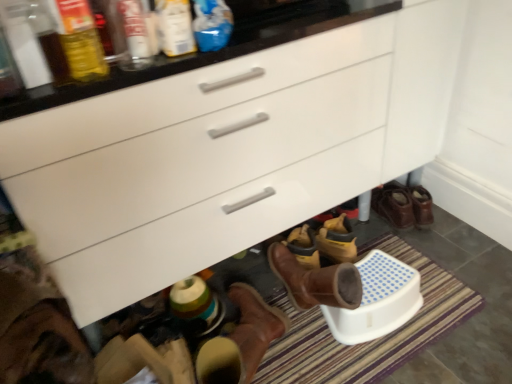
What do you see at coordinates (369, 341) in the screenshot?
I see `striped carpet at lower center` at bounding box center [369, 341].

The height and width of the screenshot is (384, 512). What are the coordinates of `brown leather boots at lower right` in the screenshot? It's located at (403, 205).

Where is `striped carpet at lower center`? The height and width of the screenshot is (384, 512). striped carpet at lower center is located at coordinates (369, 341).

From a real-world perspective, is translucent plastic bottle at upper left, which appears as the second bottle when viewed from the left, over blue plastic bottle at upper center, which appears as the first bottle when viewed from the right?

Yes, from a real-world perspective, translucent plastic bottle at upper left, which appears as the second bottle when viewed from the left, is over blue plastic bottle at upper center, which appears as the first bottle when viewed from the right

Does point (63, 44) appear closer or farther from the camera than point (198, 23)?

Point (63, 44) is positioned closer to the camera compared to point (198, 23).

Does translucent plastic bottle at upper left, the third bottle from the right, have a greater height compared to blue plastic bottle at upper center, which appears as the first bottle when viewed from the right?

Indeed, translucent plastic bottle at upper left, the third bottle from the right, has a greater height compared to blue plastic bottle at upper center, which appears as the first bottle when viewed from the right.

Considering the sizes of objects translucent plastic bottle at upper left, which appears as the second bottle when viewed from the left, and blue plastic bottle at upper center, which appears as the first bottle when viewed from the right, in the image provided, who is wider, translucent plastic bottle at upper left, which appears as the second bottle when viewed from the left, or blue plastic bottle at upper center, which appears as the first bottle when viewed from the right,?

Wider between the two is translucent plastic bottle at upper left, which appears as the second bottle when viewed from the left.

Considering the sizes of objects matte glass bottle at upper left, which ranks as the fourth bottle in right-to-left order, and blue plastic bottle at upper center, which appears as the first bottle when viewed from the right, in the image provided, who is smaller, matte glass bottle at upper left, which ranks as the fourth bottle in right-to-left order, or blue plastic bottle at upper center, which appears as the first bottle when viewed from the right,?

With smaller size is blue plastic bottle at upper center, which appears as the first bottle when viewed from the right.

Would you say matte glass bottle at upper left, which ranks as the fourth bottle in right-to-left order, is a long distance from blue plastic bottle at upper center, which appears as the first bottle when viewed from the right?

No, matte glass bottle at upper left, which ranks as the fourth bottle in right-to-left order, is in close proximity to blue plastic bottle at upper center, which appears as the first bottle when viewed from the right.

Is matte glass bottle at upper left, the first bottle viewed from the left, outside of blue plastic bottle at upper center, the fourth bottle in the left-to-right sequence?

Yes, matte glass bottle at upper left, the first bottle viewed from the left, is not within blue plastic bottle at upper center, the fourth bottle in the left-to-right sequence.

From the image's perspective, is matte glass bottle at upper left, which ranks as the fourth bottle in right-to-left order, beneath blue plastic bottle at upper center, the fourth bottle in the left-to-right sequence?

Correct, matte glass bottle at upper left, which ranks as the fourth bottle in right-to-left order, appears lower than blue plastic bottle at upper center, the fourth bottle in the left-to-right sequence, in the image.

Is blue plastic bottle at upper center, which appears as the first bottle when viewed from the right, touching striped carpet at lower center?

blue plastic bottle at upper center, which appears as the first bottle when viewed from the right, and striped carpet at lower center are not in contact.

Considering the relative positions of blue plastic bottle at upper center, which appears as the first bottle when viewed from the right, and striped carpet at lower center in the image provided, is blue plastic bottle at upper center, which appears as the first bottle when viewed from the right, to the left of striped carpet at lower center from the viewer's perspective?

Indeed, blue plastic bottle at upper center, which appears as the first bottle when viewed from the right, is positioned on the left side of striped carpet at lower center.

Could you measure the distance between blue plastic bottle at upper center, the fourth bottle in the left-to-right sequence, and striped carpet at lower center?

1.02 meters.

Can you confirm if blue plastic bottle at upper center, which appears as the first bottle when viewed from the right, is bigger than matte glass bottle at upper left, which ranks as the fourth bottle in right-to-left order?

Actually, blue plastic bottle at upper center, which appears as the first bottle when viewed from the right, might be smaller than matte glass bottle at upper left, which ranks as the fourth bottle in right-to-left order.

Based on the photo, is blue plastic bottle at upper center, the fourth bottle in the left-to-right sequence, looking in the opposite direction of matte glass bottle at upper left, the first bottle viewed from the left?

That's not correct — blue plastic bottle at upper center, the fourth bottle in the left-to-right sequence, is not looking away from matte glass bottle at upper left, the first bottle viewed from the left.

Would you say blue plastic bottle at upper center, which appears as the first bottle when viewed from the right, is outside matte glass bottle at upper left, the first bottle viewed from the left?

Yes, blue plastic bottle at upper center, which appears as the first bottle when viewed from the right, is not within matte glass bottle at upper left, the first bottle viewed from the left.

Is blue plastic bottle at upper center, the fourth bottle in the left-to-right sequence, with matte glass bottle at upper left, the first bottle viewed from the left?

No, blue plastic bottle at upper center, the fourth bottle in the left-to-right sequence, is not next to matte glass bottle at upper left, the first bottle viewed from the left.

Which is more to the left, matte plastic bottle at upper center, the 3th bottle when ordered from left to right, or brown leather boots at lower right?

From the viewer's perspective, matte plastic bottle at upper center, the 3th bottle when ordered from left to right, appears more on the left side.

Looking at their sizes, would you say matte plastic bottle at upper center, positioned as the second bottle in right-to-left order, is wider or thinner than brown leather boots at lower right?

matte plastic bottle at upper center, positioned as the second bottle in right-to-left order, is thinner than brown leather boots at lower right.

The width and height of the screenshot is (512, 384). Identify the location of footwear beneath the matte plastic bottle at upper center, the 3th bottle when ordered from left to right (from a real-world perspective). (403, 205).

Which is further, (85,4) or (432,313)?

Positioned behind is point (432,313).

Considering the sizes of objects translucent plastic bottle at upper left, which appears as the second bottle when viewed from the left, and striped carpet at lower center in the image provided, who is taller, translucent plastic bottle at upper left, which appears as the second bottle when viewed from the left, or striped carpet at lower center?

translucent plastic bottle at upper left, which appears as the second bottle when viewed from the left.

From the image's perspective, which bottle is the 2nd one above the striped carpet at lower center? Please provide its 2D coordinates.

[(80, 40)]

Is translucent plastic bottle at upper left, the third bottle from the right, situated inside striped carpet at lower center or outside?

translucent plastic bottle at upper left, the third bottle from the right, is spatially situated outside striped carpet at lower center.

From a real-world perspective, who is located lower, striped carpet at lower center or translucent plastic bottle at upper left, the third bottle from the right?

striped carpet at lower center.

Is striped carpet at lower center completely or partially outside of translucent plastic bottle at upper left, the third bottle from the right?

striped carpet at lower center lies outside translucent plastic bottle at upper left, the third bottle from the right,'s area.

Is point (404, 341) closer or farther from the camera than point (108, 73)?

Clearly, point (404, 341) is more distant from the camera than point (108, 73).

Relative to translucent plastic bottle at upper left, which appears as the second bottle when viewed from the left, is striped carpet at lower center in front or behind?

Clearly, striped carpet at lower center is behind translucent plastic bottle at upper left, which appears as the second bottle when viewed from the left.

I want to click on bottle that is the 3rd object above the blue plastic bottle at upper center, which appears as the first bottle when viewed from the right (from a real-world perspective), so click(x=80, y=40).

Locate an element on the screen. This screenshot has width=512, height=384. the 3rd bottle to the right of the matte glass bottle at upper left, the first bottle viewed from the left, counting from the anchor's position is located at coordinates (212, 24).

Which object lies further to the anchor point striped carpet at lower center, translucent plastic bottle at upper left, the third bottle from the right, or blue plastic bottle at upper center, which appears as the first bottle when viewed from the right?

translucent plastic bottle at upper left, the third bottle from the right, is positioned further to the anchor striped carpet at lower center.

Estimate the real-world distances between objects in this image. Which object is further from translucent plastic bottle at upper left, which appears as the second bottle when viewed from the left, matte plastic bottle at upper center, positioned as the second bottle in right-to-left order, or brown leather boots at lower right?

Based on the image, brown leather boots at lower right appears to be further to translucent plastic bottle at upper left, which appears as the second bottle when viewed from the left.

Which object lies further to the anchor point brown leather boots at lower right, matte glass bottle at upper left, which ranks as the fourth bottle in right-to-left order, or striped carpet at lower center?

Based on the image, matte glass bottle at upper left, which ranks as the fourth bottle in right-to-left order, appears to be further to brown leather boots at lower right.

From the image, which object appears to be farther from matte plastic bottle at upper center, positioned as the second bottle in right-to-left order, brown leather boots at lower right or blue plastic bottle at upper center, which appears as the first bottle when viewed from the right?

brown leather boots at lower right lies further to matte plastic bottle at upper center, positioned as the second bottle in right-to-left order, than the other object.

Estimate the real-world distances between objects in this image. Which object is closer to blue plastic bottle at upper center, which appears as the first bottle when viewed from the right, brown leather boots at lower right or striped carpet at lower center?

striped carpet at lower center.

From the image, which object appears to be farther from matte plastic bottle at upper center, positioned as the second bottle in right-to-left order, matte glass bottle at upper left, which ranks as the fourth bottle in right-to-left order, or translucent plastic bottle at upper left, which appears as the second bottle when viewed from the left?

matte glass bottle at upper left, which ranks as the fourth bottle in right-to-left order, is further to matte plastic bottle at upper center, positioned as the second bottle in right-to-left order.

Estimate the real-world distances between objects in this image. Which object is closer to translucent plastic bottle at upper left, the third bottle from the right, brown leather boots at lower right or blue plastic bottle at upper center, the fourth bottle in the left-to-right sequence?

blue plastic bottle at upper center, the fourth bottle in the left-to-right sequence, is positioned closer to the anchor translucent plastic bottle at upper left, the third bottle from the right.

In the scene shown: Considering their positions, is blue plastic bottle at upper center, the fourth bottle in the left-to-right sequence, positioned further to translucent plastic bottle at upper left, which appears as the second bottle when viewed from the left, than brown leather boots at lower right?

brown leather boots at lower right is further to translucent plastic bottle at upper left, which appears as the second bottle when viewed from the left.

This screenshot has width=512, height=384. Identify the location of bath mat located between translucent plastic bottle at upper left, which appears as the second bottle when viewed from the left, and brown leather boots at lower right in the left-right direction. (369, 341).

The image size is (512, 384). What are the coordinates of `bath mat between matte glass bottle at upper left, the first bottle viewed from the left, and brown leather boots at lower right, in the horizontal direction` in the screenshot? It's located at (369, 341).

Where is `bottle between translucent plastic bottle at upper left, the third bottle from the right, and striped carpet at lower center, in the vertical direction`? This screenshot has width=512, height=384. bottle between translucent plastic bottle at upper left, the third bottle from the right, and striped carpet at lower center, in the vertical direction is located at coordinates 24,44.

Locate an element on the screen. The height and width of the screenshot is (384, 512). bath mat located between matte plastic bottle at upper center, the 3th bottle when ordered from left to right, and brown leather boots at lower right in the left-right direction is located at coordinates (369, 341).